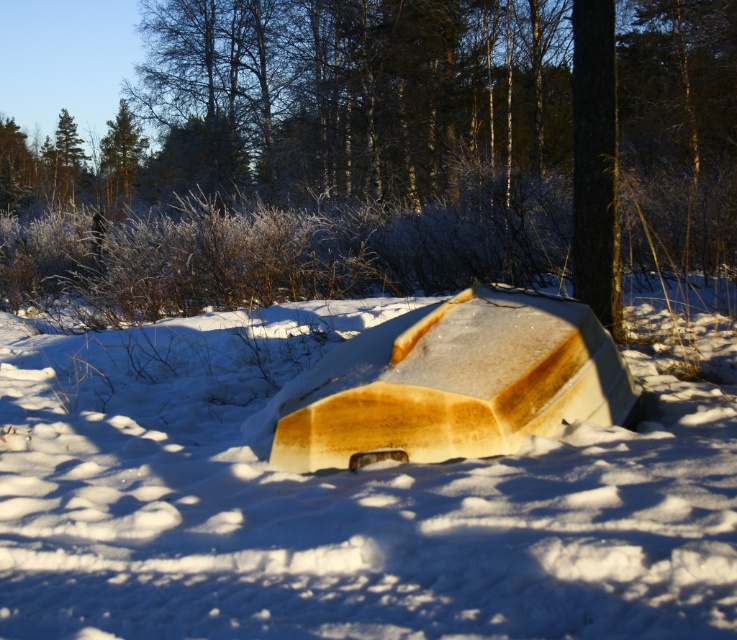
You are standing in the winter forest scene and want to move from the point closer to you to the point further away. Which path would you take between the two points, point (x=450, y=602) and point (x=105, y=209)?

You should take the path from point (x=450, y=602) to point (x=105, y=209) because point (x=450, y=602) is closer to the viewer and the other point is further away.

You are standing at the point marked as point (454, 381) in the winter forest scene. What object is located exactly at your current position?

The wooden canoe at center is located exactly at point (454, 381).

You are an explorer in a snowy forest and need to reach the green matte tree at upper left from the white matte boat at center. Which direction should you head to move towards the tree?

The white matte boat at center is to the right of the green matte tree at upper left, so you should head to the left to move towards the tree.